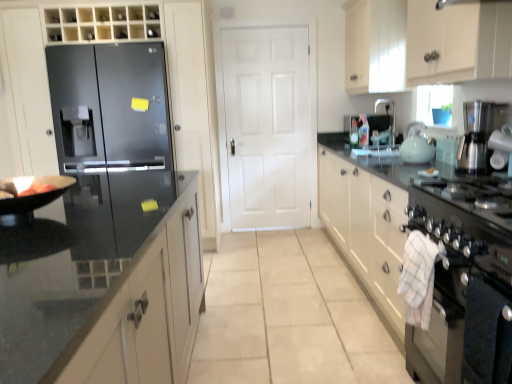
Question: Which is correct: black stainless steel oven at lower right is inside white matte door at center, or outside of it?

Choices:
 (A) inside
 (B) outside

Answer: (B)

Question: Is point (409, 205) closer or farther from the camera than point (276, 213)?

Choices:
 (A) farther
 (B) closer

Answer: (B)

Question: Which is nearer to the black stainless steel oven at lower right?

Choices:
 (A) white glossy cabinet at right, which is the 1th cabinetry from right to left
 (B) white matte door at center
 (C) light blue glass tea pot at right
 (D) glossy black refrigerator at left, which is counted as the 1th cabinetry, starting from the left
 (E) satin black refrigerator at left

Answer: (A)

Question: Which is nearer to the light blue glass tea pot at right?

Choices:
 (A) white glossy sink at upper right
 (B) glossy black refrigerator at left, the 3th cabinetry when ordered from right to left
 (C) white glossy cabinet at right, which is the 1th cabinetry from right to left
 (D) satin black refrigerator at left
 (E) translucent glass soap dispenser at upper right, the 2th appliance from the bottom

Answer: (A)